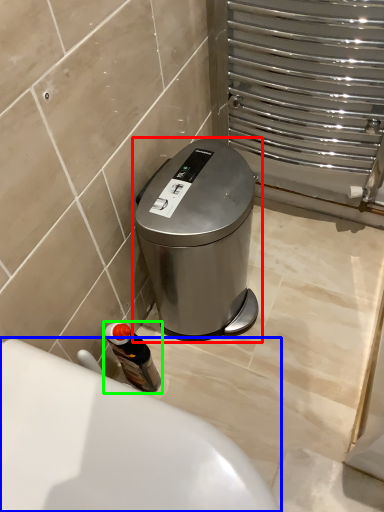
Question: Estimate the real-world distances between objects in this image. Which object is closer to waste container (highlighted by a red box), bath (highlighted by a blue box) or bottle (highlighted by a green box)?

Choices:
 (A) bath
 (B) bottle

Answer: (B)